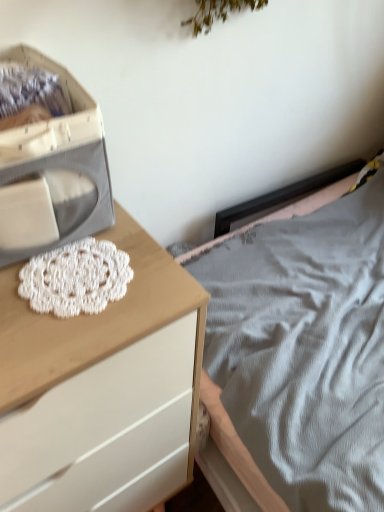
The width and height of the screenshot is (384, 512). Find the location of `free space in front of white crochet doily at center-left`. free space in front of white crochet doily at center-left is located at coordinates (63, 340).